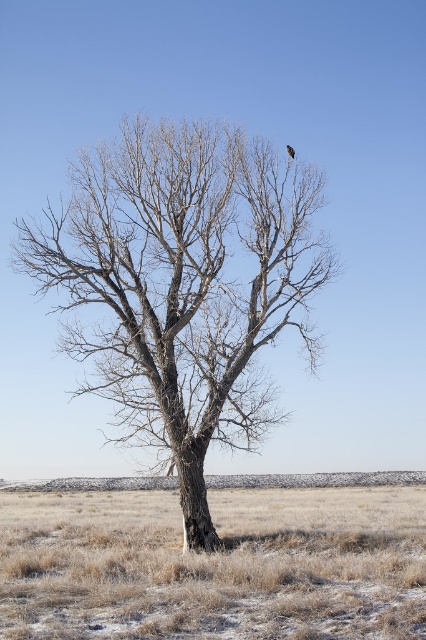
Is dry grass at lower center further to camera compared to brown feathered bird at center?

No, it is not.

Can you confirm if dry grass at lower center is positioned to the left of brown feathered bird at center?

Yes, dry grass at lower center is to the left of brown feathered bird at center.

Does point (204, 636) come closer to viewer compared to point (293, 150)?

That is True.

This screenshot has height=640, width=426. Identify the location of dry grass at lower center. (215, 564).

Which is behind, point (304, 275) or point (293, 150)?

The point (304, 275) is more distant.

Is brown bark tree at center thinner than brown feathered bird at center?

No, brown bark tree at center is not thinner than brown feathered bird at center.

Consider the image. Measure the distance between brown bark tree at center and camera.

A distance of 14.59 meters exists between brown bark tree at center and camera.

Find the location of `brown bark tree at center`. brown bark tree at center is located at coordinates (181, 285).

Consider the image. Can you confirm if brown bark tree at center is shorter than dry grass at lower center?

Yes, brown bark tree at center is shorter than dry grass at lower center.

Image resolution: width=426 pixels, height=640 pixels. I want to click on brown bark tree at center, so click(181, 285).